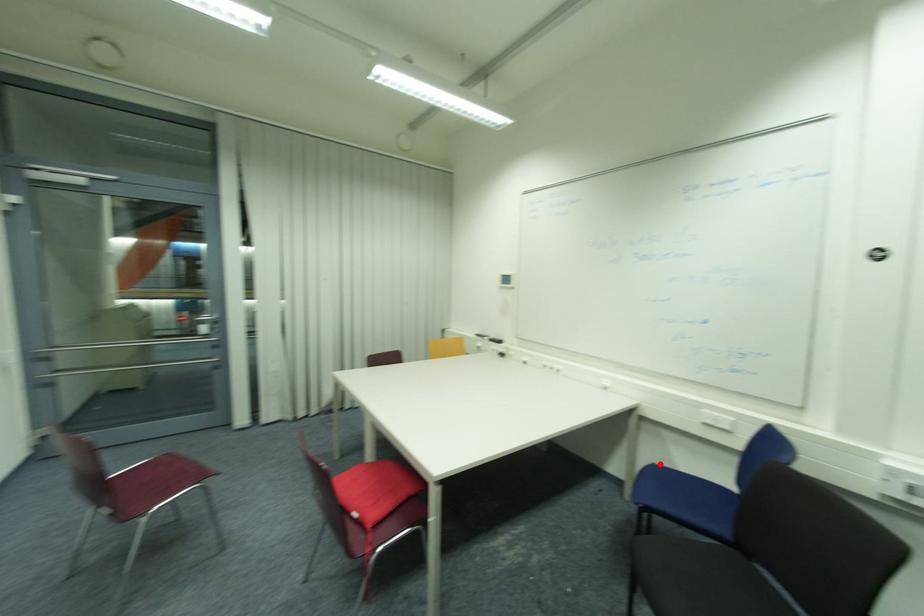
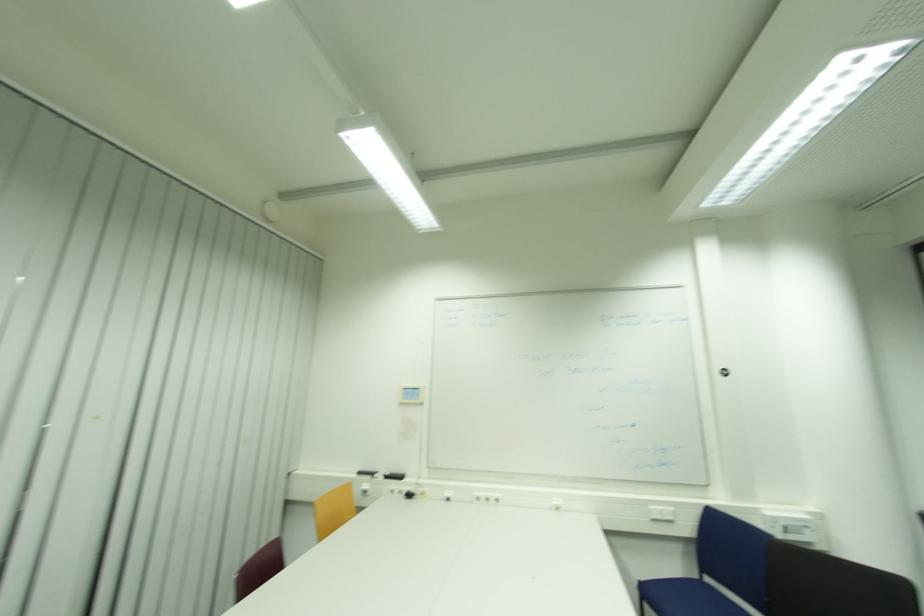
The point at the highlighted location is marked in the first image. Where is the corresponding point in the second image?

(648, 581)